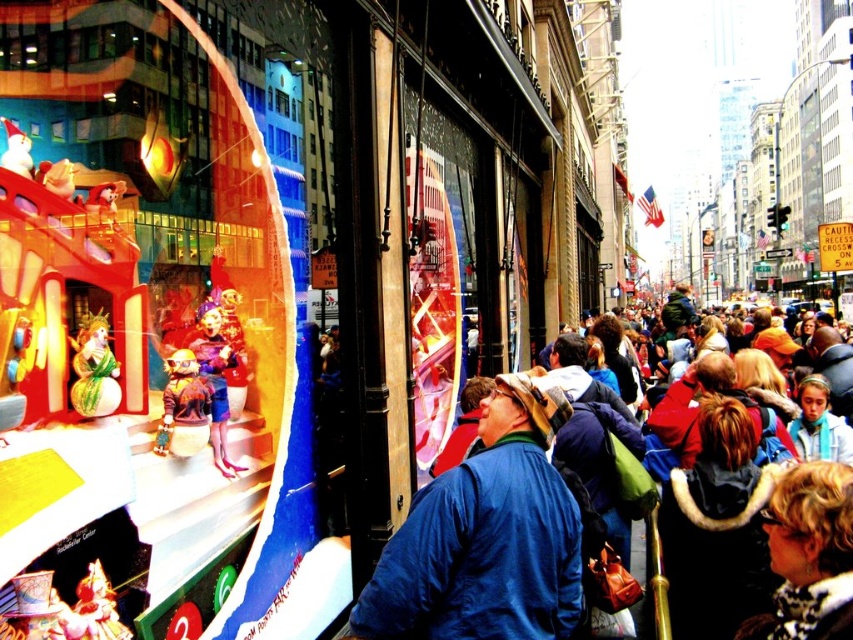
Question: Which point is closer to the camera taking this photo?

Choices:
 (A) (730, 404)
 (B) (111, 394)
 (C) (468, 612)

Answer: (B)

Question: Considering the relative positions of blue fabric jacket at center and plush teddy bear at left in the image provided, where is blue fabric jacket at center located with respect to plush teddy bear at left?

Choices:
 (A) right
 (B) left

Answer: (A)

Question: Which point is closer to the camera taking this photo?

Choices:
 (A) (476, 464)
 (B) (834, 493)

Answer: (B)

Question: Is plush teddy bear at left wider than matte plastic clown at center?

Choices:
 (A) no
 (B) yes

Answer: (B)

Question: Is blue fabric jacket at center to the left of matte plastic clown at center from the viewer's perspective?

Choices:
 (A) no
 (B) yes

Answer: (A)

Question: Which of the following is the closest to the observer?

Choices:
 (A) shiny gold snowman at center
 (B) blue jacket at center
 (C) matte plastic clown at center

Answer: (B)